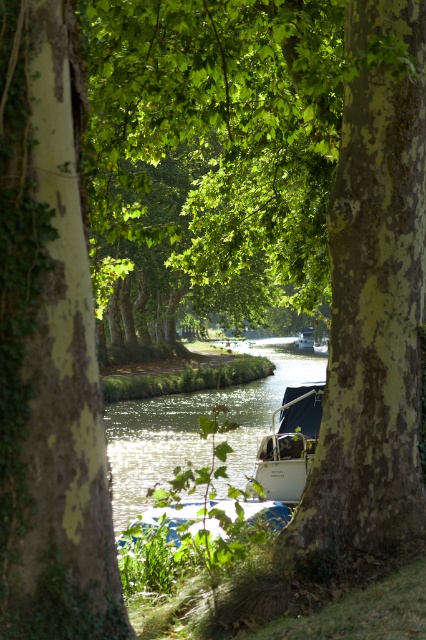
You are standing on the riverside and want to take a photo of both the green smooth water at center and the white matte boat at center. Which object should you focus on first to ensure both are in the frame?

The green smooth water at center is in front of the white matte boat at center, so you should focus on the white matte boat at center first to ensure both are in the frame.

You are standing at the riverside and want to take a photo of the green smooth water at center. According to the scene description, where should you position yourself to capture the water in the frame?

The green smooth water at center is located at point 0.667 on the x and 0.465 on the y coordinates, so you should position yourself at that coordinate to capture it.

You are standing at the riverside and see two points marked in the scene. Which point is closer to you, point (236,412) or point (305,445)?

Point (236,412) is closer to you because it is further to the viewer than point (305,445).